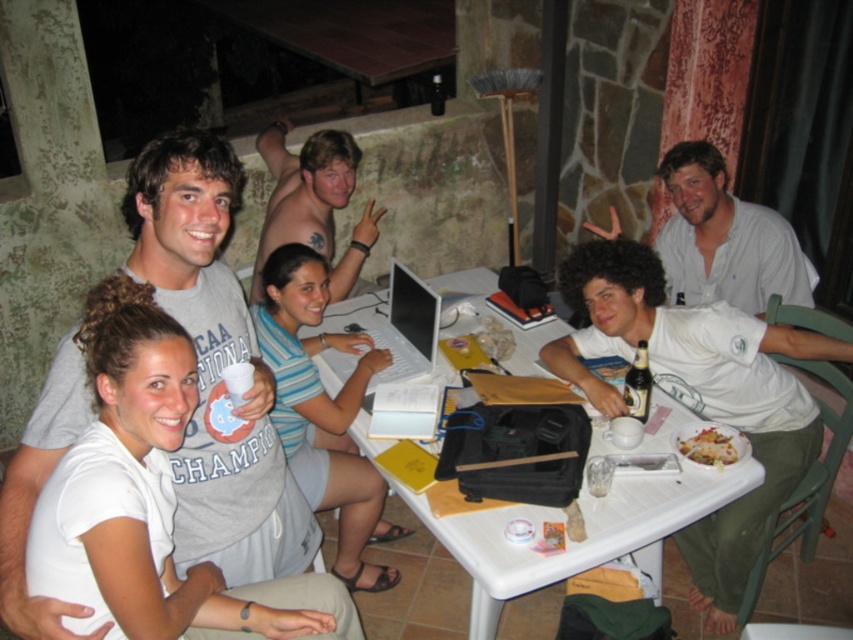
Is white cotton shirt at center taller than white cotton shirt at upper right?

Correct, white cotton shirt at center is much taller as white cotton shirt at upper right.

At what (x,y) coordinates should I click in order to perform the action: click on white cotton shirt at center. Please return your answer as a coordinate pair (x, y). The width and height of the screenshot is (853, 640). Looking at the image, I should click on (699, 394).

Who is more distant from viewer, [730,384] or [741,227]?

Positioned behind is point [741,227].

Find the location of `white cotton shirt at center`. white cotton shirt at center is located at coordinates (699, 394).

Who is positioned more to the right, white cotton shirt at center or brown glass bottle at center?

white cotton shirt at center

Which is behind, point (701, 337) or point (643, 364)?

The point (701, 337) is behind.

The height and width of the screenshot is (640, 853). I want to click on white cotton shirt at center, so click(x=699, y=394).

Find the location of a particular element. shiny brown hair at center is located at coordinates (303, 192).

Can you confirm if shiny brown hair at center is positioned above white glossy plate at lower center?

Correct, shiny brown hair at center is located above white glossy plate at lower center.

The width and height of the screenshot is (853, 640). What do you see at coordinates (303, 192) in the screenshot?
I see `shiny brown hair at center` at bounding box center [303, 192].

You are a GUI agent. You are given a task and a screenshot of the screen. Output one action in this format:
    pyautogui.click(x=<x>, y=<y>)
    Task: Click on the shiny brown hair at center
    
    Given the screenshot: What is the action you would take?
    [x=303, y=192]